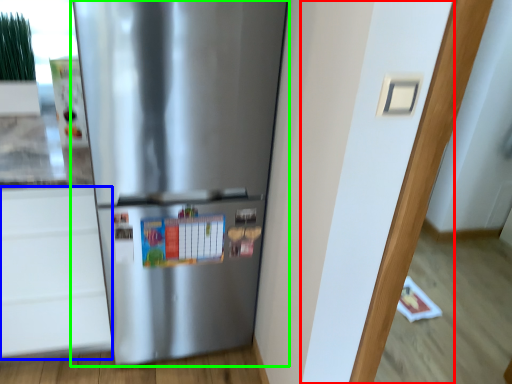
Question: Which object is positioned farthest from door (highlighted by a red box)? Select from drawer (highlighted by a blue box) and refrigerator (highlighted by a green box).

Choices:
 (A) drawer
 (B) refrigerator

Answer: (A)